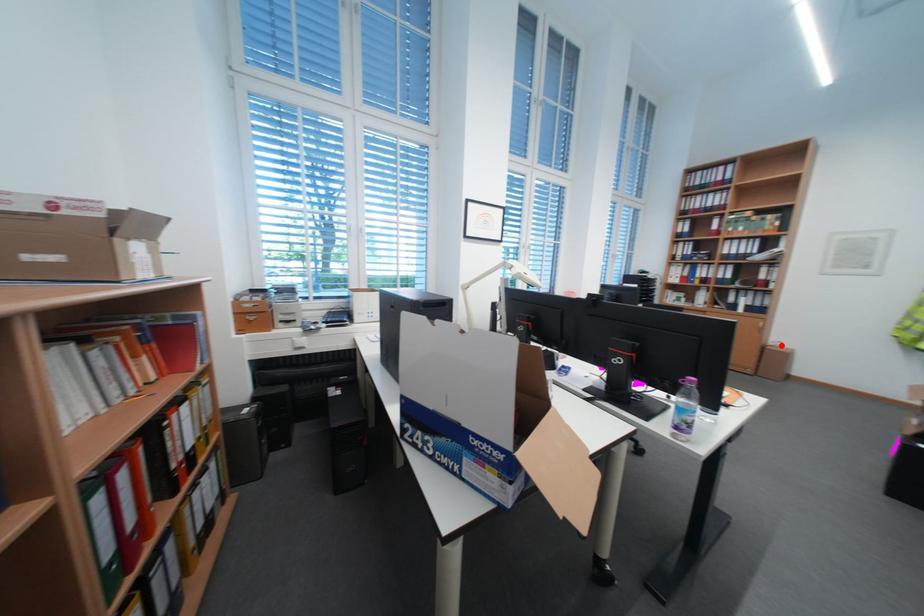
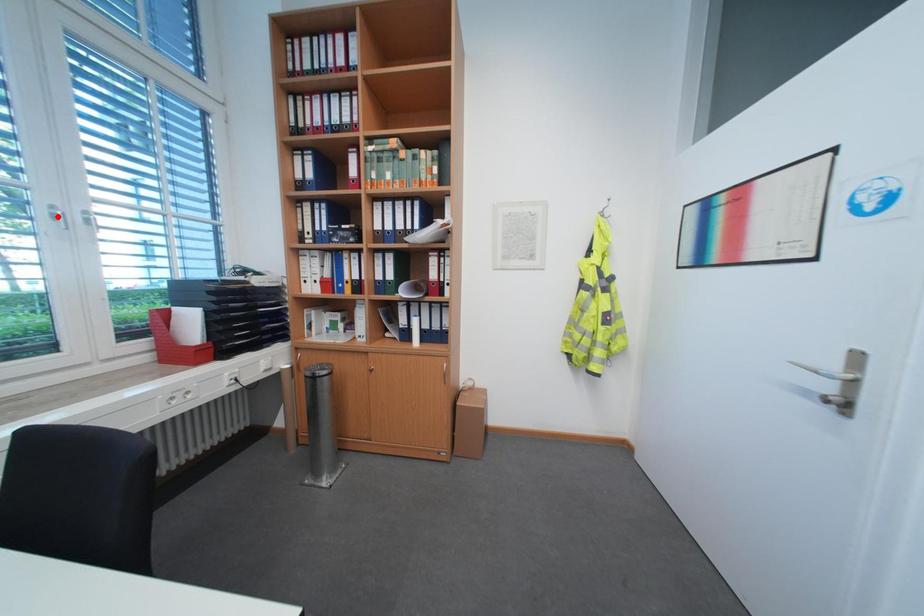
I am providing you with two images of the same scene from different viewpoints. A red point is marked on the first image and another point is marked on the second image. Is the marked point in image1 the same physical position as the marked point in image2?

No